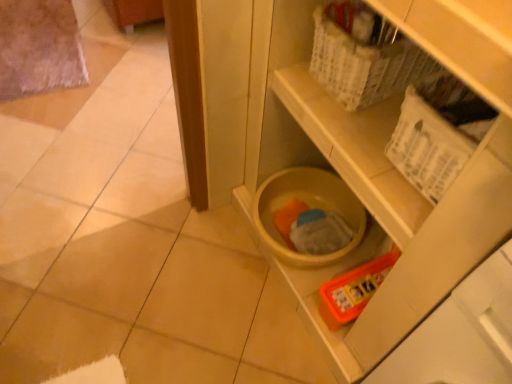
Find the location of a particular element. Image resolution: width=512 pixels, height=384 pixels. white plastic basket at upper right is located at coordinates (437, 132).

This screenshot has width=512, height=384. What do you see at coordinates (437, 132) in the screenshot? I see `white plastic basket at upper right` at bounding box center [437, 132].

What are the coordinates of `white plastic basket at upper right` in the screenshot? It's located at (437, 132).